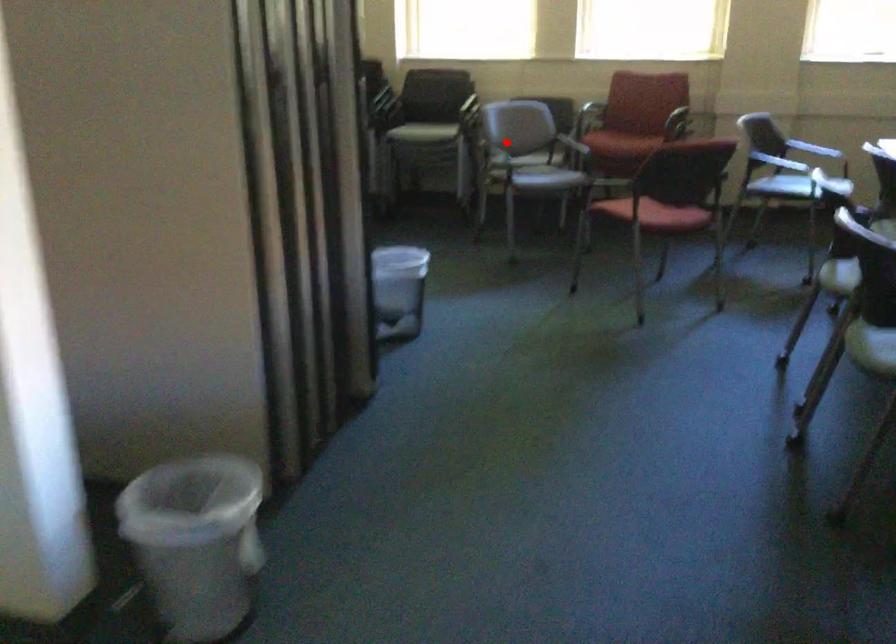
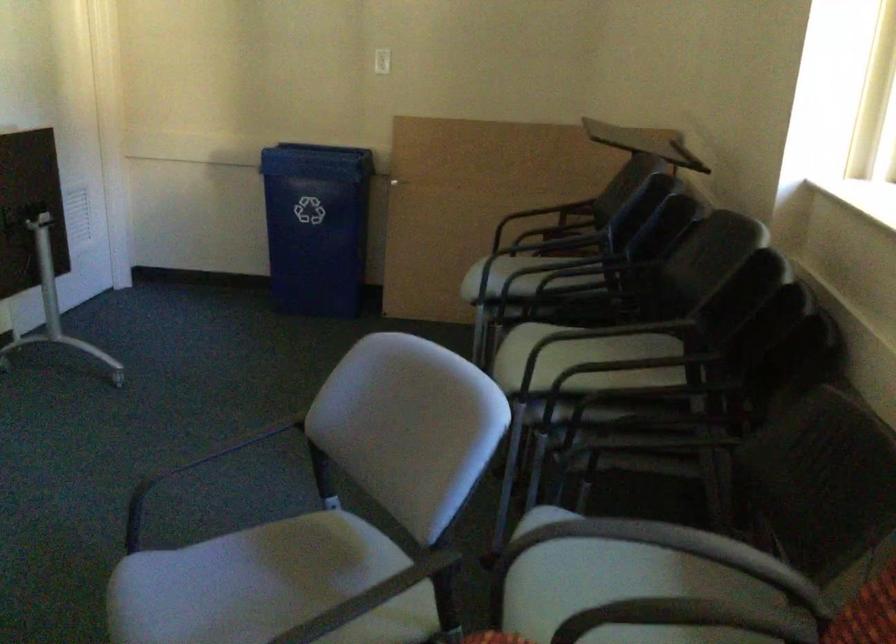
Question: I am providing you with two images of the same scene from different viewpoints. Given a red point in image1, look at the same physical point in image2. Is it:

Choices:
 (A) Closer to the viewpoint
 (B) Farther from the viewpoint

Answer: (A)